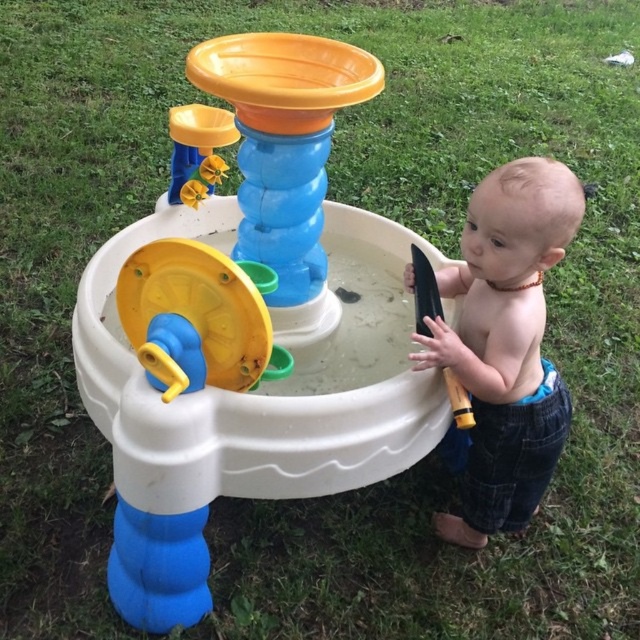
Question: Is white plastic water table at center to the right of yellow plastic wheel at center from the viewer's perspective?

Choices:
 (A) no
 (B) yes

Answer: (B)

Question: Does smooth tan skin at right lie behind yellow plastic wheel at center?

Choices:
 (A) yes
 (B) no

Answer: (A)

Question: Which object is the closest to the yellow plastic wheel at center?

Choices:
 (A) white plastic water table at center
 (B) smooth tan skin at right

Answer: (A)

Question: Which of the following is the closest to the observer?

Choices:
 (A) (445, 285)
 (B) (173, 586)

Answer: (B)

Question: Does white plastic water table at center have a smaller size compared to smooth tan skin at right?

Choices:
 (A) no
 (B) yes

Answer: (A)

Question: Estimate the real-world distances between objects in this image. Which object is closer to the white plastic water table at center?

Choices:
 (A) yellow plastic wheel at center
 (B) smooth tan skin at right

Answer: (A)